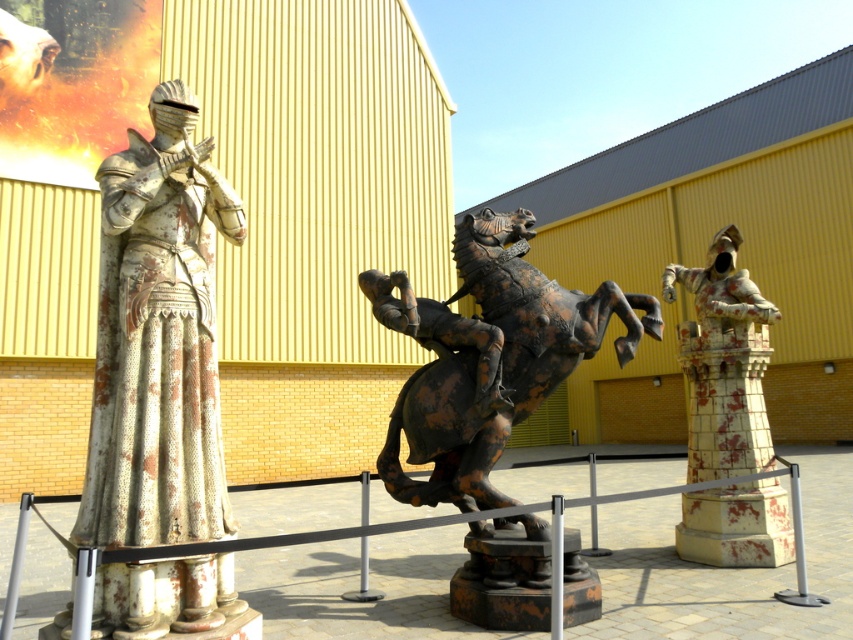
You are a tour guide explaining the statues to visitors. You point out the rusty metal horse at center and the white tiled tower at right. Which one is closer to the visitors standing in front of the statues?

The rusty metal horse at center is closer to the visitors because it is positioned in front of the white tiled tower at right.

You are a tour guide explaining the statues to visitors. You mention that the rusty metal knight at left and the rusty metal horse at center are part of the same exhibit. Based on their sizes, which one would you say is the smaller one?

The rusty metal knight at left is smaller in size compared to the rusty metal horse at center.